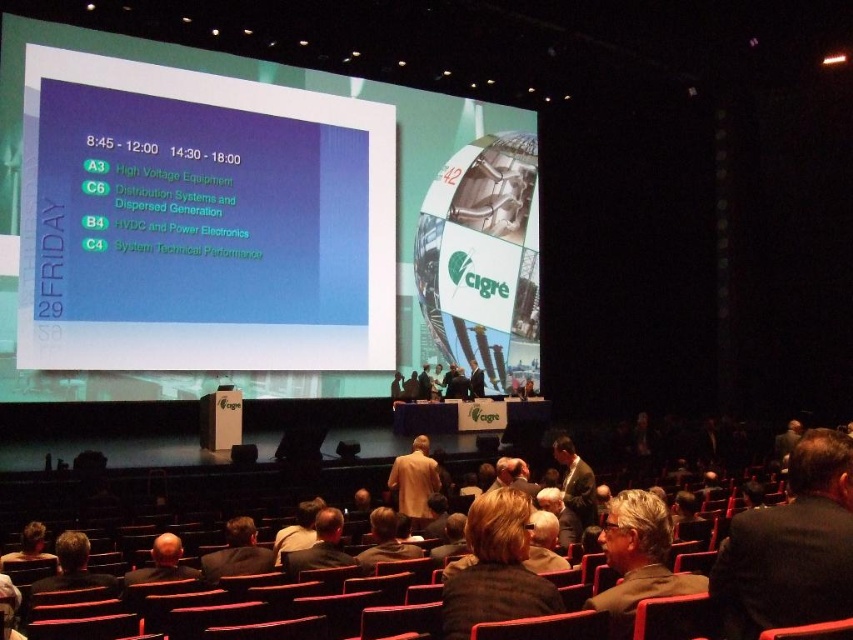
You are sitting in the audience of the auditorium and see the white glossy projector screen at upper left and the dark brown suit at lower left. Which object is higher in the image?

The white glossy projector screen at upper left is higher in the image than the dark brown suit at lower left.

Looking at this image, you are sitting in the front row of the auditorium and want to take a photo of the white glossy projector screen at upper left. Where should you aim your camera to capture the screen?

You should aim your camera at point (201,221) to capture the white glossy projector screen at upper left.